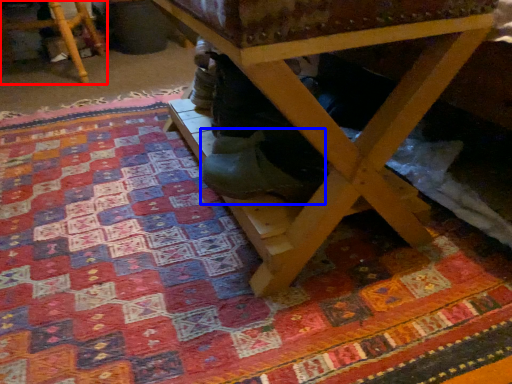
Question: Which object is further to the camera taking this photo, furniture (highlighted by a red box) or shoe (highlighted by a blue box)?

Choices:
 (A) furniture
 (B) shoe

Answer: (A)